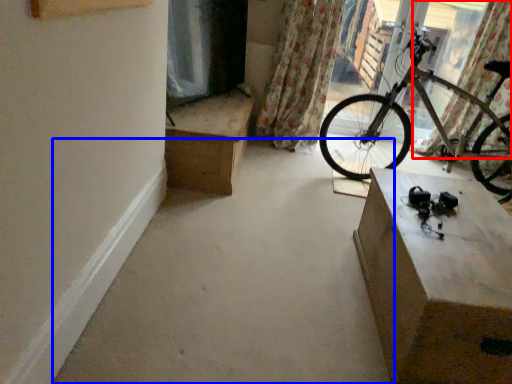
Question: Which object appears closest to the camera in this image, curtain (highlighted by a red box) or concrete (highlighted by a blue box)?

Choices:
 (A) curtain
 (B) concrete

Answer: (B)